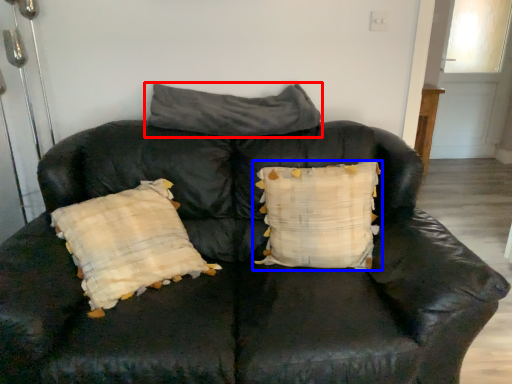
Question: Which of the following is the closest to the observer, pillow (highlighted by a red box) or pillow (highlighted by a blue box)?

Choices:
 (A) pillow
 (B) pillow

Answer: (B)